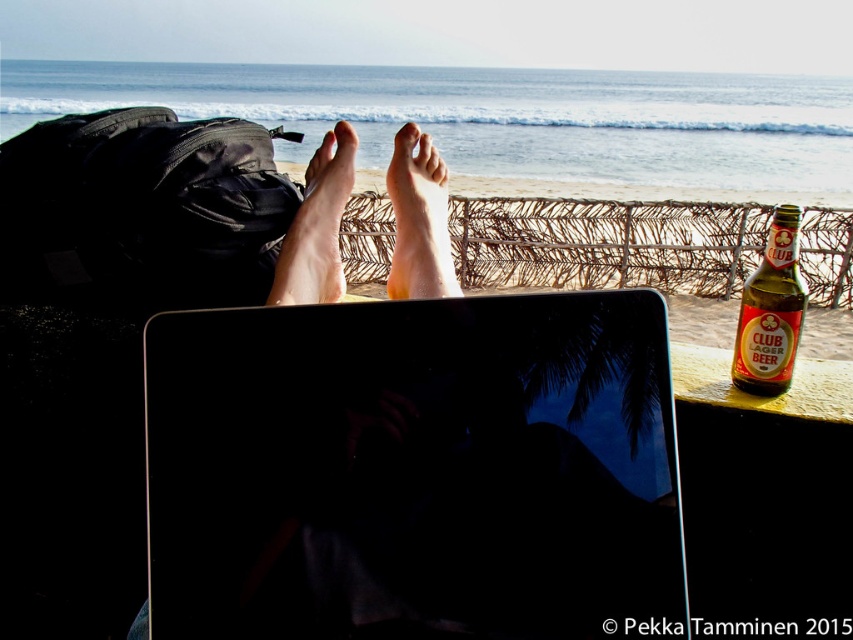
Question: Is black glossy laptop at center smaller than dry skin foot at center?

Choices:
 (A) yes
 (B) no

Answer: (A)

Question: Which object is the closest to the green glass bottle at right?

Choices:
 (A) pale skin foot at center
 (B) black glossy laptop at center
 (C) dry skin foot at center

Answer: (C)

Question: Can you confirm if dry skin foot at center is smaller than pale skin foot at center?

Choices:
 (A) no
 (B) yes

Answer: (B)

Question: Which of these objects is positioned farthest from the green glass bottle at right?

Choices:
 (A) black glossy laptop at center
 (B) pale skin foot at center

Answer: (B)

Question: Among these objects, which one is nearest to the camera?

Choices:
 (A) dry skin foot at center
 (B) black glossy laptop at center
 (C) green glass bottle at right

Answer: (B)

Question: Does black glossy laptop at center appear on the left side of dry skin foot at center?

Choices:
 (A) yes
 (B) no

Answer: (B)